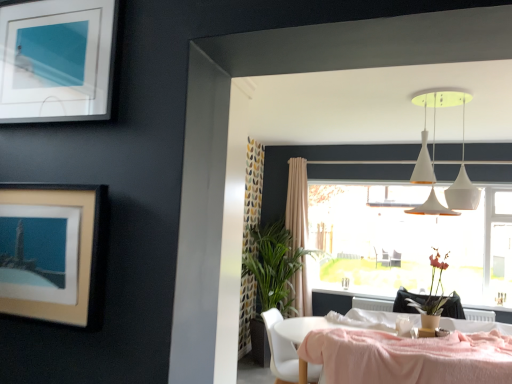
Question: Does white plastic chair at lower center lie behind beige fabric curtain at center?

Choices:
 (A) yes
 (B) no

Answer: (B)

Question: Is white plastic chair at lower center wider than beige fabric curtain at center?

Choices:
 (A) no
 (B) yes

Answer: (B)

Question: From a real-world perspective, is white plastic chair at lower center below beige fabric curtain at center?

Choices:
 (A) no
 (B) yes

Answer: (B)

Question: Is white plastic chair at lower center oriented away from beige fabric curtain at center?

Choices:
 (A) no
 (B) yes

Answer: (A)

Question: Can you see white plastic chair at lower center touching beige fabric curtain at center?

Choices:
 (A) no
 (B) yes

Answer: (A)

Question: Can you confirm if white plastic chair at lower center is positioned to the right of beige fabric curtain at center?

Choices:
 (A) yes
 (B) no

Answer: (B)

Question: Does white matte pendant lights at upper center appear on the right side of matte silver picture frame at upper left, the second picture frame from the bottom?

Choices:
 (A) no
 (B) yes

Answer: (B)

Question: From the image's perspective, would you say white matte pendant lights at upper center is positioned over matte silver picture frame at upper left, the second picture frame from the bottom?

Choices:
 (A) yes
 (B) no

Answer: (B)

Question: Considering the relative sizes of white matte pendant lights at upper center and matte silver picture frame at upper left, the second picture frame from the bottom, in the image provided, is white matte pendant lights at upper center taller than matte silver picture frame at upper left, the second picture frame from the bottom,?

Choices:
 (A) yes
 (B) no

Answer: (A)

Question: From a real-world perspective, is white matte pendant lights at upper center under matte silver picture frame at upper left, the second picture frame from the bottom?

Choices:
 (A) no
 (B) yes

Answer: (A)

Question: Is white matte pendant lights at upper center turned away from matte silver picture frame at upper left, the second picture frame from the bottom?

Choices:
 (A) yes
 (B) no

Answer: (B)

Question: Is white matte pendant lights at upper center aimed at matte silver picture frame at upper left, which ranks as the 1th picture frame in top-to-bottom order?

Choices:
 (A) no
 (B) yes

Answer: (A)

Question: From the image's perspective, would you say beige matte picture frame at upper left, the first picture frame in the bottom-to-top sequence, is shown under transparent glass window at center?

Choices:
 (A) no
 (B) yes

Answer: (A)